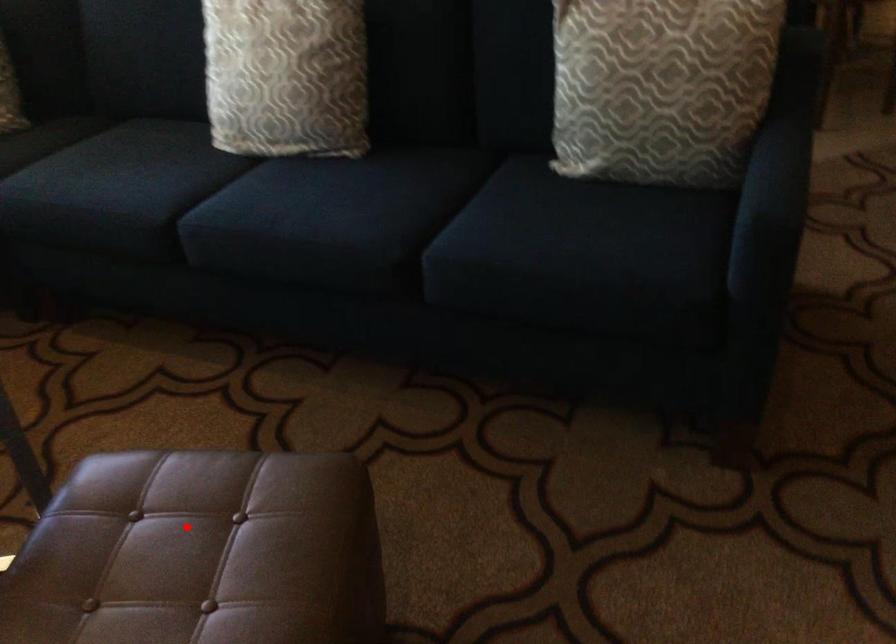
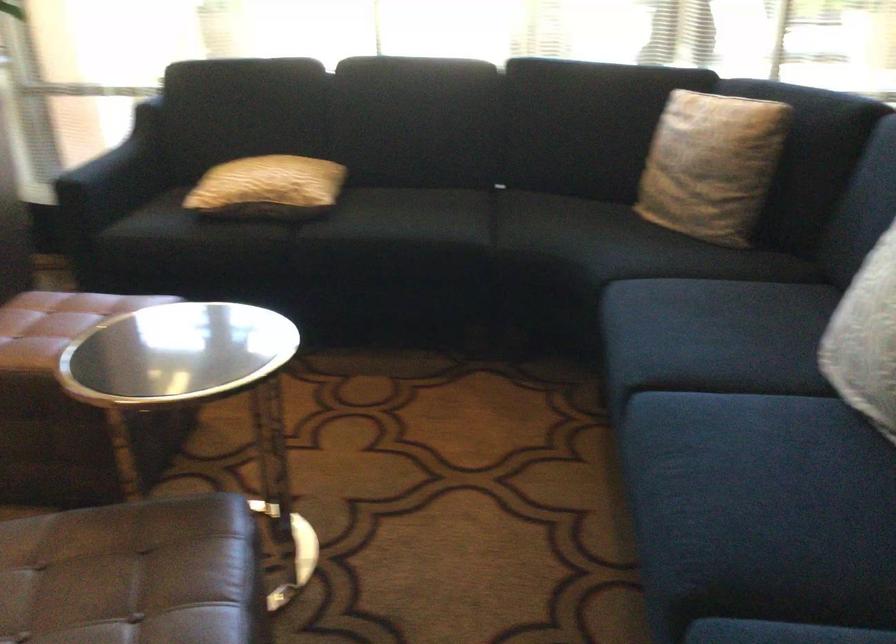
The point at the highlighted location is marked in the first image. Where is the corresponding point in the second image?

(134, 574)